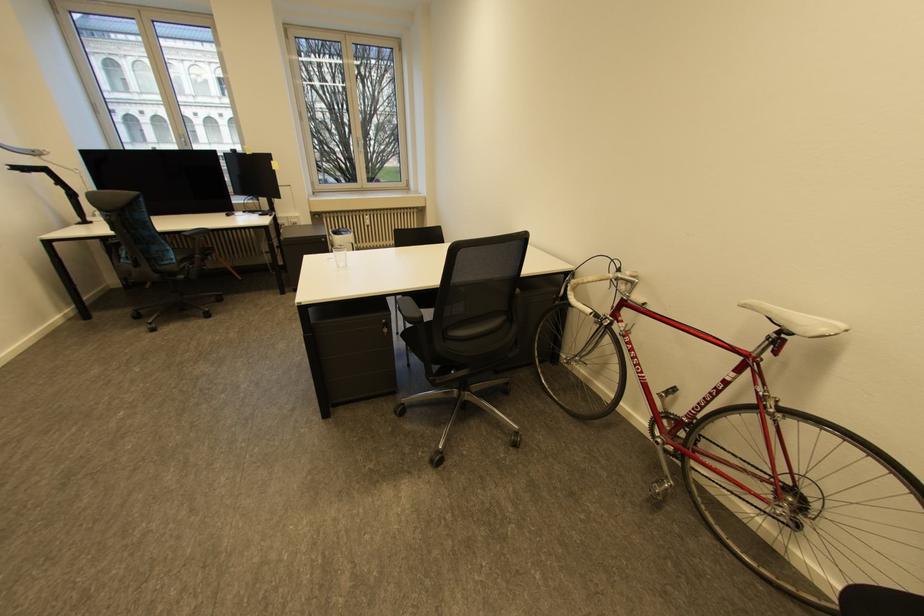
The height and width of the screenshot is (616, 924). Find the location of `white bicycle seat`. white bicycle seat is located at coordinates (796, 320).